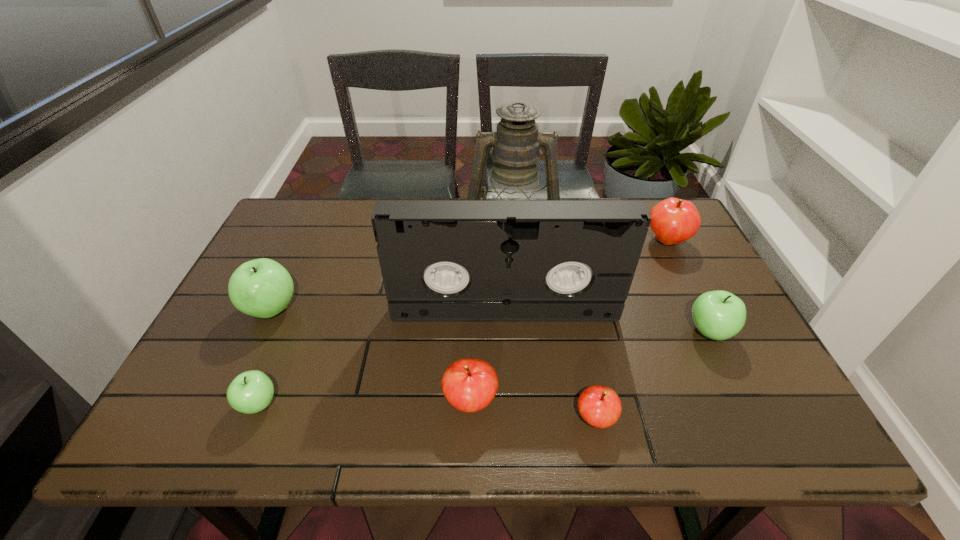
What are the coordinates of `green apple that is the second closest one to the tallest object` in the screenshot? It's located at (262, 288).

Image resolution: width=960 pixels, height=540 pixels. I want to click on red apple that can be found as the second closest to the tallest object, so click(469, 385).

Identify which red apple is located as the nearest to the biggest red apple. Please provide its 2D coordinates. Your answer should be formatted as a tuple, i.e. [(x, y)], where the tuple contains the x and y coordinates of a point satisfying the conditions above.

[(600, 406)]

The height and width of the screenshot is (540, 960). I want to click on vacant region that satisfies the following two spatial constraints: 1. on the back side of the leftmost red apple; 2. on the right side of the smallest green apple, so click(x=259, y=401).

Find the location of a particular element. Image resolution: width=960 pixels, height=540 pixels. free space that satisfies the following two spatial constraints: 1. on the side of the smallest red apple with visible spindles; 2. on the right side of the second tallest object is located at coordinates (511, 418).